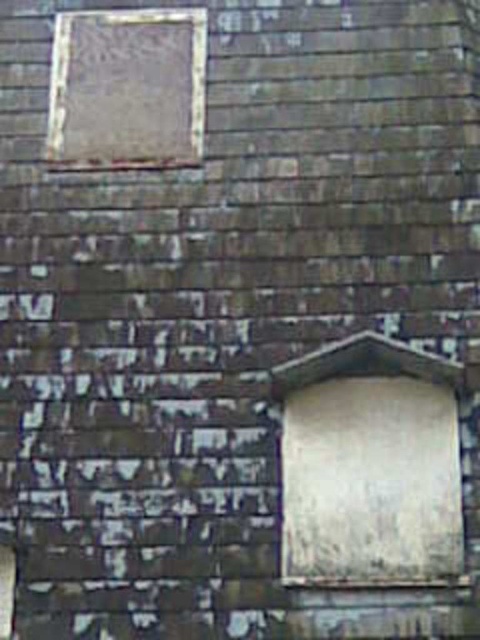
In the scene shown: Which is below, white matte window at lower right or matte glass window at upper left?

Positioned lower is white matte window at lower right.

Image resolution: width=480 pixels, height=640 pixels. I want to click on white matte window at lower right, so click(370, 465).